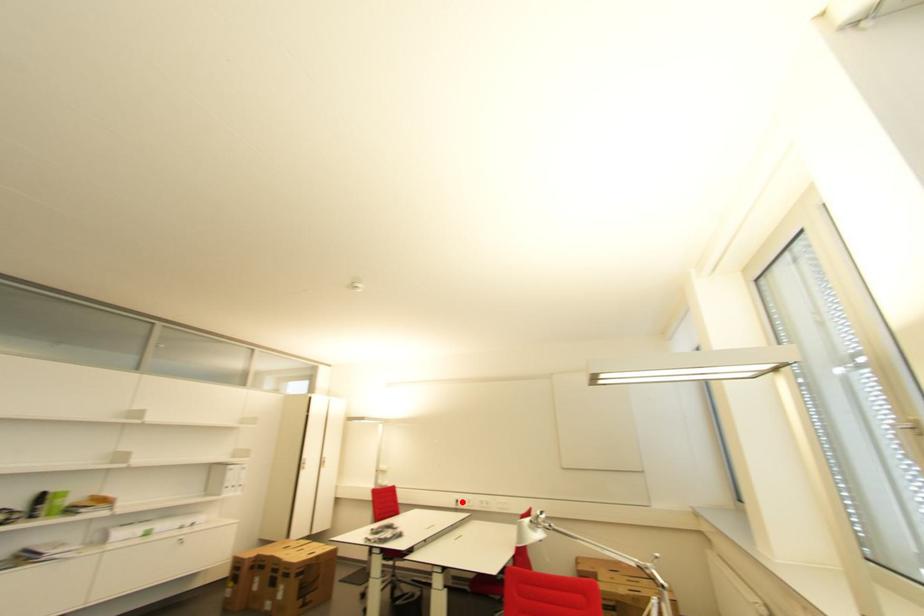
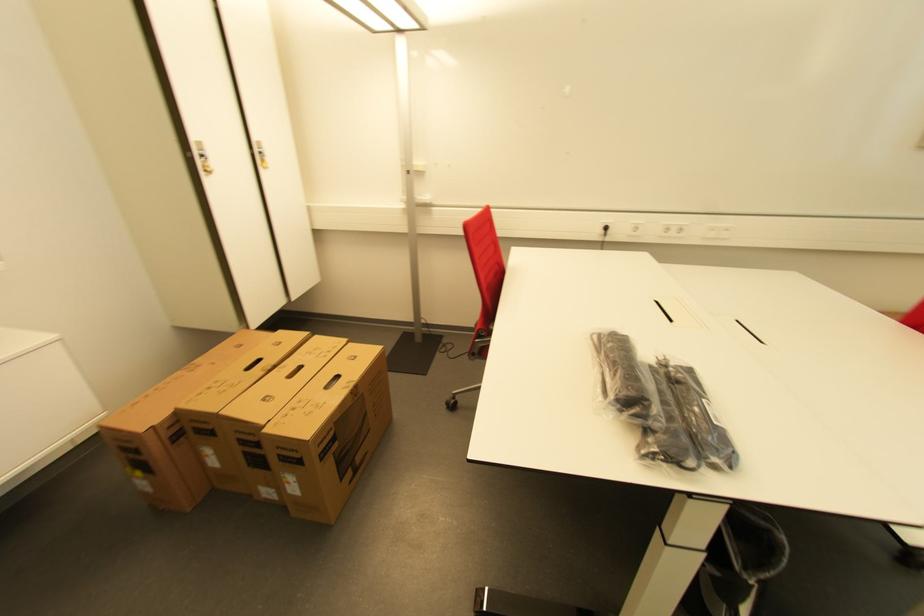
Find the pixel in the second image that matches the highlighted location in the first image.

(611, 230)